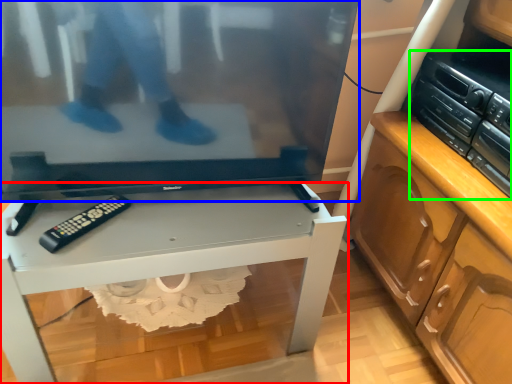
Question: Estimate the real-world distances between objects in this image. Which object is farther from desk (highlighted by a red box), television (highlighted by a blue box) or stereo (highlighted by a green box)?

Choices:
 (A) television
 (B) stereo

Answer: (B)